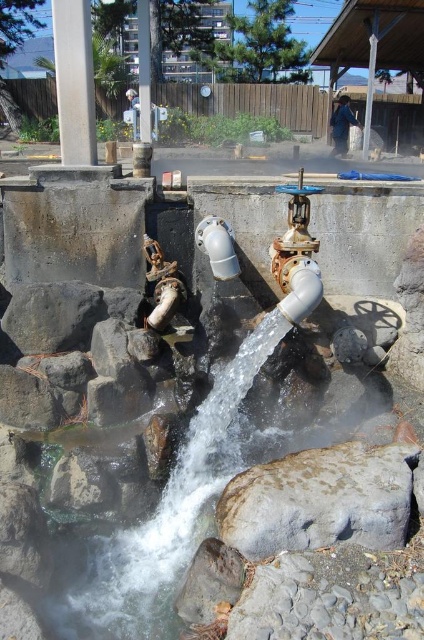
Who is more forward, [382,464] or [301,220]?

Positioned in front is point [382,464].

Between gray rough stone at center and gold metallic valve at center right, which one appears on the left side from the viewer's perspective?

gold metallic valve at center right

Where is `gray rough stone at center`? Image resolution: width=424 pixels, height=640 pixels. gray rough stone at center is located at coordinates (320, 500).

Image resolution: width=424 pixels, height=640 pixels. What do you see at coordinates (320, 500) in the screenshot? I see `gray rough stone at center` at bounding box center [320, 500].

Is point (242, 497) in front of point (342, 108)?

Yes, it is.

The image size is (424, 640). In order to click on gray rough stone at center in this screenshot , I will do `click(320, 500)`.

Is white matte pipe at center wider than metallic blue pipe at upper right?

Correct, the width of white matte pipe at center exceeds that of metallic blue pipe at upper right.

Who is lower down, white matte pipe at center or metallic blue pipe at upper right?

white matte pipe at center is lower down.

Find the location of a particular element. The width and height of the screenshot is (424, 640). white matte pipe at center is located at coordinates tap(217, 246).